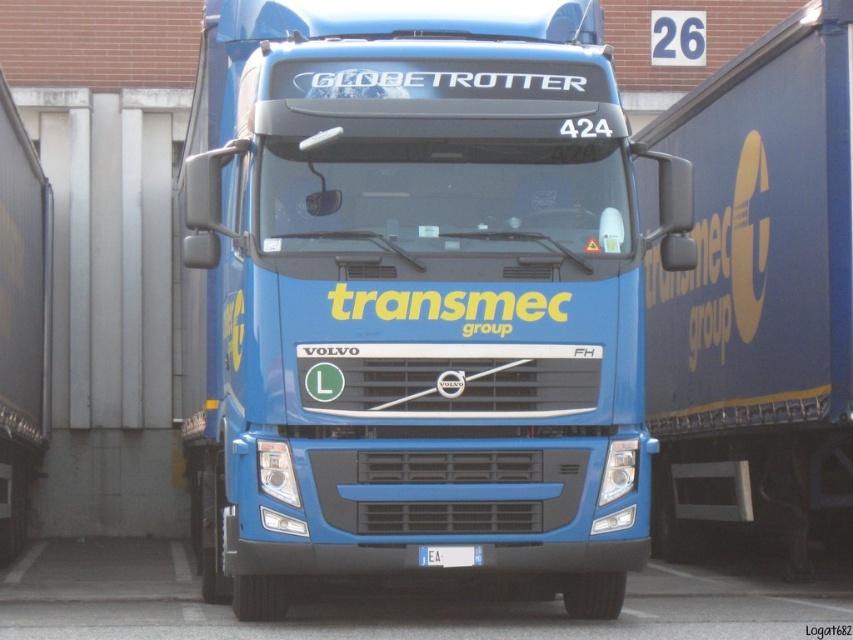
Can you confirm if blue matte trailer truck at right is positioned below white plastic license plate at center?

Actually, blue matte trailer truck at right is above white plastic license plate at center.

Is point (759, 298) closer to viewer compared to point (440, 556)?

That is False.

I want to click on blue matte trailer truck at right, so click(x=758, y=292).

Find the location of a particular element. blue matte trailer truck at right is located at coordinates (758, 292).

Based on the photo, is blue metallic truck at center smaller than blue matte trailer truck at right?

Incorrect, blue metallic truck at center is not smaller in size than blue matte trailer truck at right.

Between blue metallic truck at center and blue matte trailer truck at right, which one is positioned higher?

Positioned higher is blue matte trailer truck at right.

The image size is (853, 640). What do you see at coordinates (415, 296) in the screenshot? I see `blue metallic truck at center` at bounding box center [415, 296].

The width and height of the screenshot is (853, 640). Identify the location of blue metallic truck at center. (415, 296).

Is blue metallic truck at center smaller than white plastic license plate at center?

No, blue metallic truck at center is not smaller than white plastic license plate at center.

Which is below, blue metallic truck at center or white plastic license plate at center?

white plastic license plate at center is below.

Image resolution: width=853 pixels, height=640 pixels. What are the coordinates of `blue metallic truck at center` in the screenshot? It's located at (415, 296).

I want to click on blue metallic truck at center, so click(415, 296).